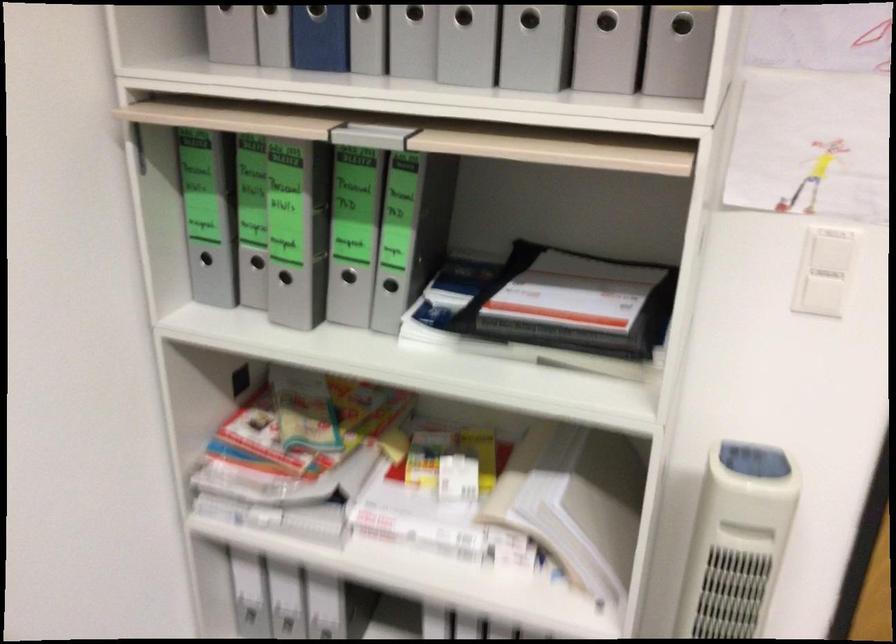
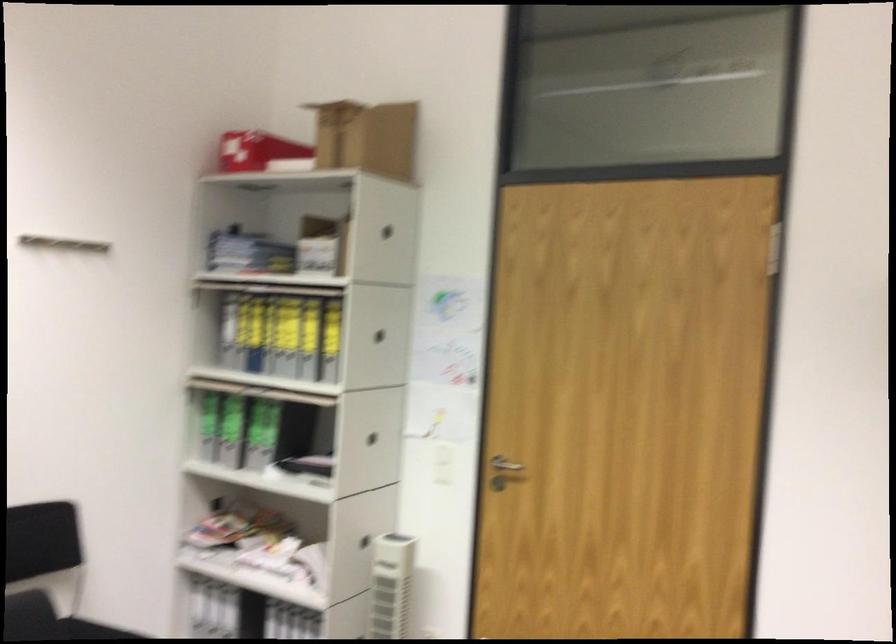
In the second image, find the point that corresponds to [822,283] in the first image.

(444, 462)